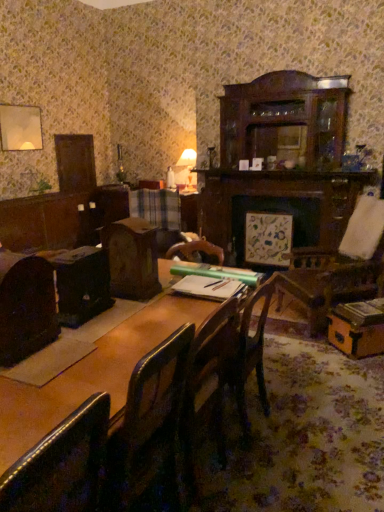
In order to click on free region under dark brown leather chair at left, positioned as the second chair in bottom-to-top order (from a real-world perspective) in this screenshot , I will do `click(43, 346)`.